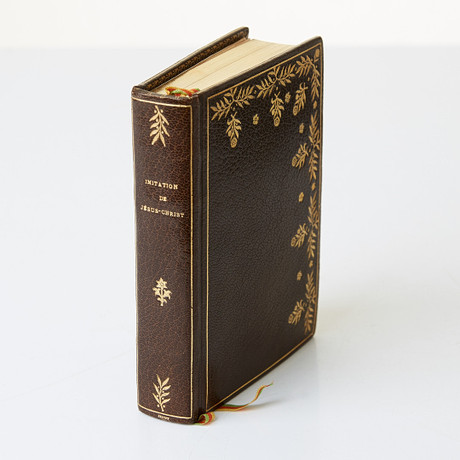
Locate an element on the screen. This screenshot has height=460, width=460. top edge of book spine is located at coordinates (155, 95).